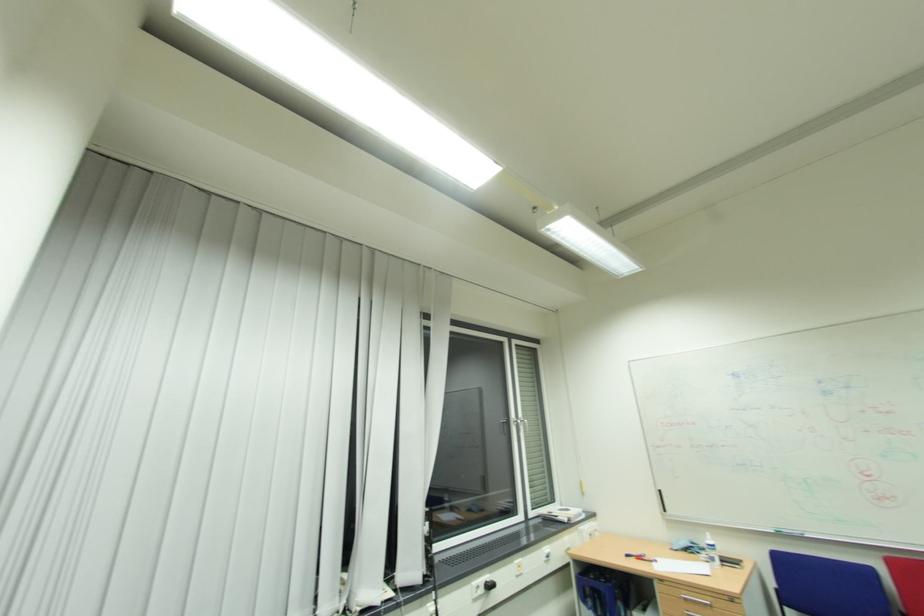
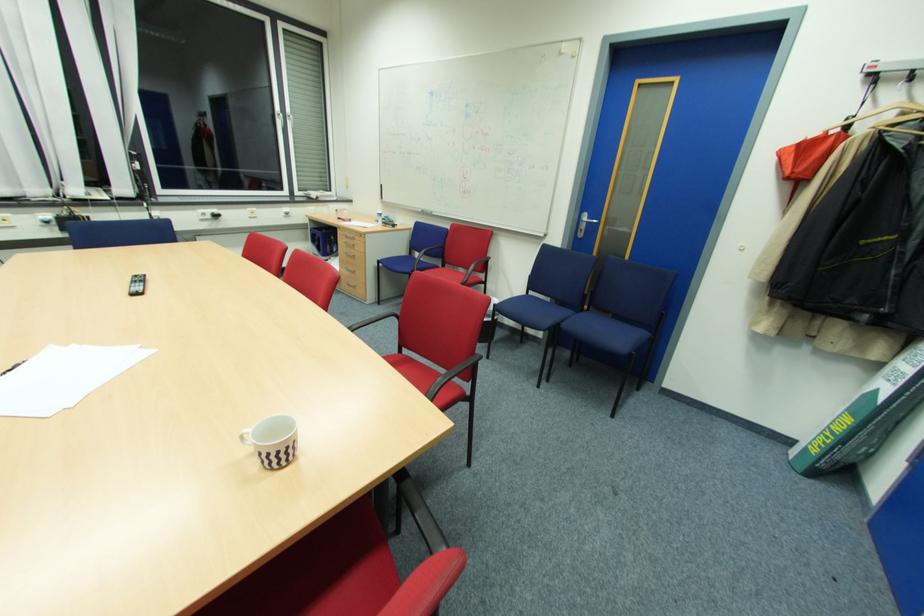
Locate, in the second image, the point that corresponds to point (671, 583) in the first image.

(344, 229)